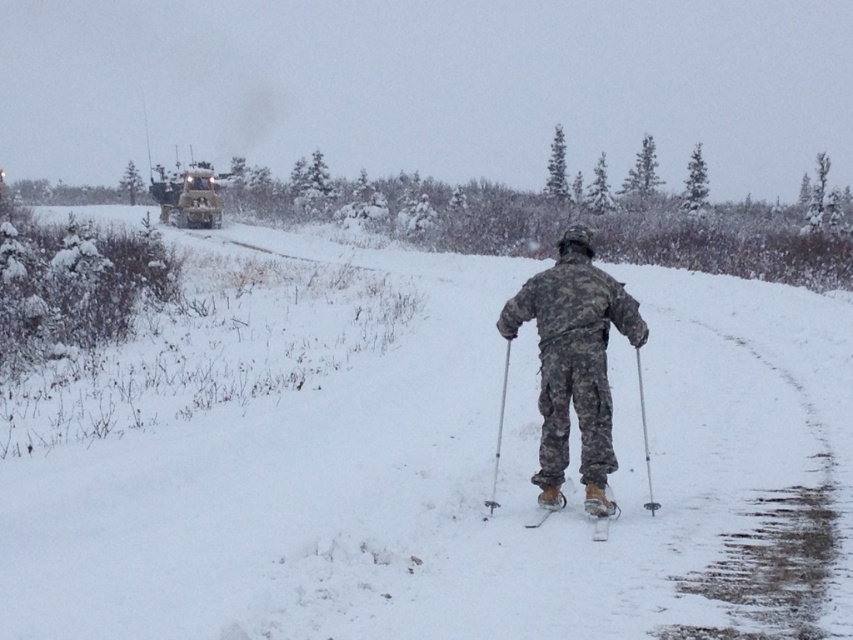
In the scene shown: You are a drone operator trying to capture a clear image of both the skier and the vehicle in the snowy landscape. The drone is currently positioned at point A, which is at coordinates point (505, 394). You need to adjust the drone to point B at coordinates point (654, 502) to get a better shot of the vehicle. Will moving the drone from point A to point B bring it closer to the vehicle?

Yes, moving the drone from point A to point B will bring it closer to the vehicle because point A is further away from the viewer than point B, meaning point B is closer to the vehicle.

You are a drone operator controlling a drone that needs to fly from point A to point B in the snowy landscape. The coordinates for point A are point (573, 310) and point B are point (650, 468). According to the scene, which point is closer to the skier?

Point (573, 310) is in front of point (650, 468), so it is closer to the skier.